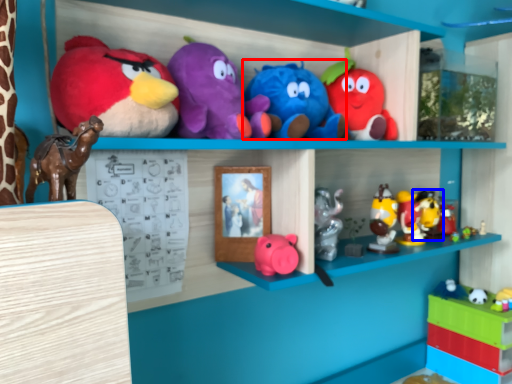
Question: Which of the following is the closest to the observer, toy (highlighted by a red box) or toy (highlighted by a blue box)?

Choices:
 (A) toy
 (B) toy

Answer: (A)